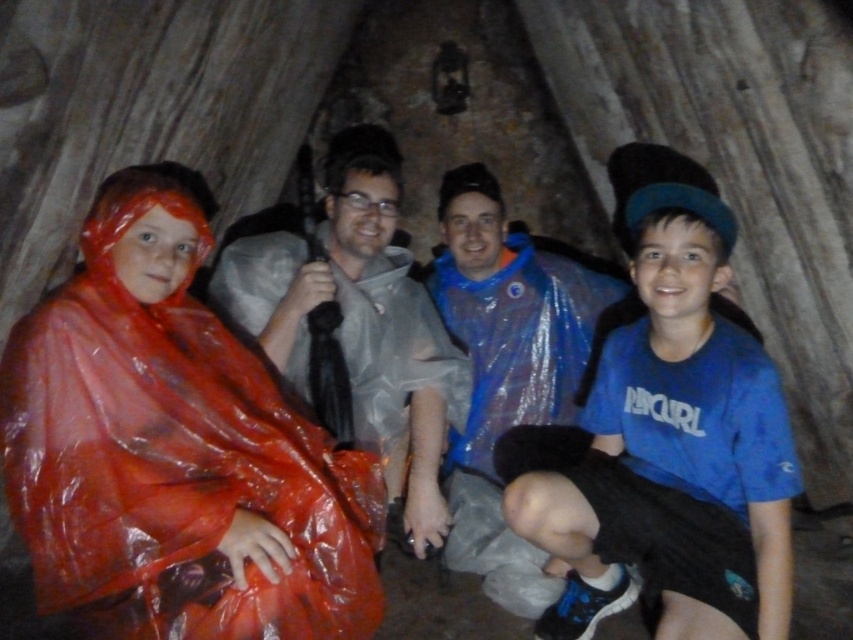
Between point (616, 164) and point (404, 380), which one is positioned in front?

Point (404, 380)

Who is lower down, blue cotton shirt at center or matte gray raincoat at center?

matte gray raincoat at center

Where is `blue cotton shirt at center`? blue cotton shirt at center is located at coordinates (666, 436).